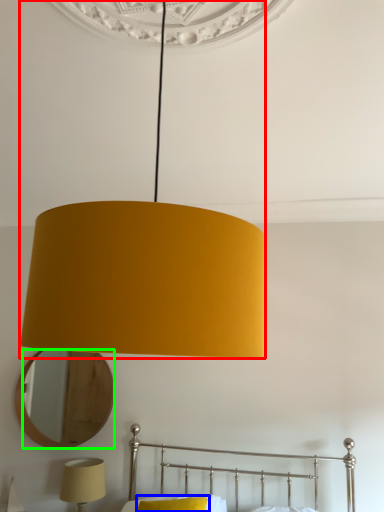
Question: Which is nearer to the lamp (highlighted by a red box)? pillow (highlighted by a blue box) or mirror (highlighted by a green box).

Choices:
 (A) pillow
 (B) mirror

Answer: (A)